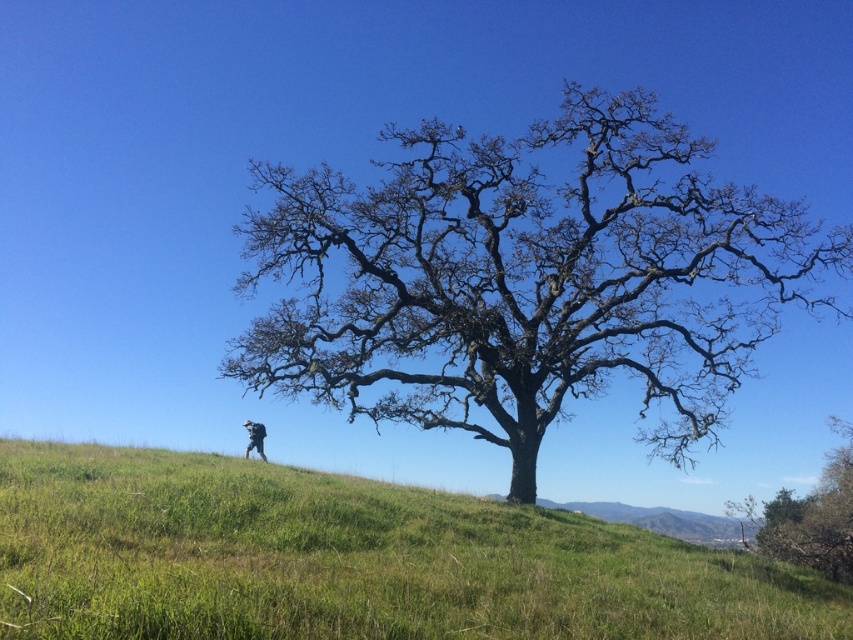
You are standing in the outdoor scene and want to take a photo of the camouflage fabric jacket at lower center without the bare branches at center appearing in the frame. Which direction should you move to achieve this?

Move to the left so that the camouflage fabric jacket at lower center is positioned away from the bare branches at center, which are to the right of it.